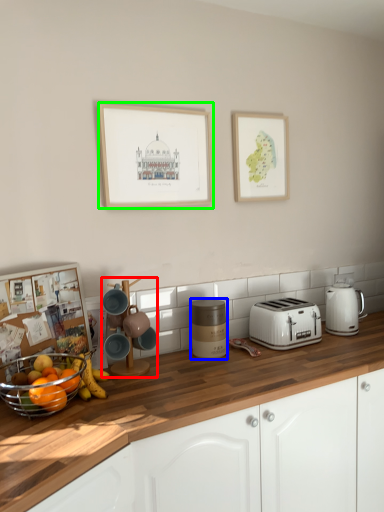
Question: Based on their relative distances, which object is nearer to coffee machine (highlighted by a red box)? Choose from appliance (highlighted by a blue box) and picture frame (highlighted by a green box).

Choices:
 (A) appliance
 (B) picture frame

Answer: (A)